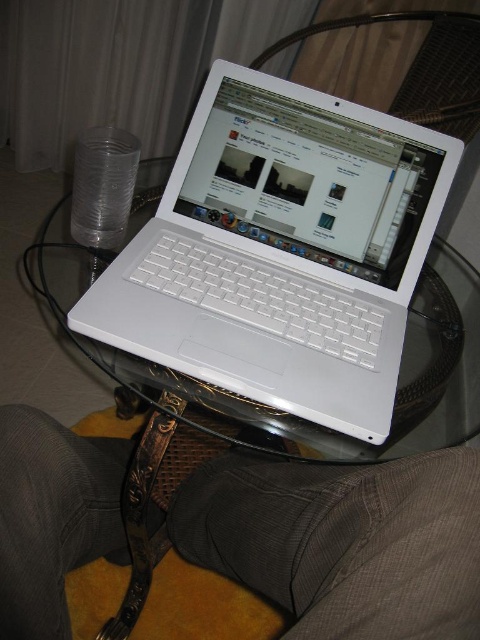
Question: Does white glossy laptop at center appear on the right side of gray fabric pants at lower center?

Choices:
 (A) yes
 (B) no

Answer: (A)

Question: Which of the following is the farthest from the observer?

Choices:
 (A) gray fabric pants at lower center
 (B) white glossy laptop at center

Answer: (B)

Question: Among these objects, which one is farthest from the camera?

Choices:
 (A) white glossy laptop at center
 (B) gray fabric pants at lower center

Answer: (A)

Question: Does white glossy laptop at center appear under gray fabric pants at lower center?

Choices:
 (A) yes
 (B) no

Answer: (B)

Question: Which of the following is the farthest from the observer?

Choices:
 (A) (391, 486)
 (B) (251, 113)

Answer: (B)

Question: Where is white glossy laptop at center located in relation to gray fabric pants at lower center in the image?

Choices:
 (A) left
 (B) right

Answer: (B)